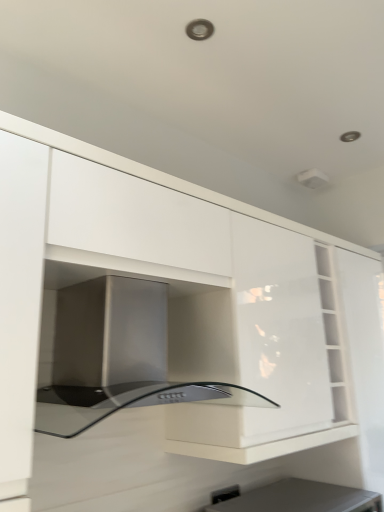
Question: From the image's perspective, relative to black plastic electric outlet at lower center, is matte black appliance at lower center above or below?

Choices:
 (A) below
 (B) above

Answer: (A)

Question: Considering the positions of point (336, 493) and point (221, 488), is point (336, 493) closer or farther from the camera than point (221, 488)?

Choices:
 (A) farther
 (B) closer

Answer: (B)

Question: Based on their relative distances, which object is farther from the stainless steel oven at center?

Choices:
 (A) black plastic electric outlet at lower center
 (B) matte black appliance at lower center

Answer: (A)

Question: Estimate the real-world distances between objects in this image. Which object is farther from the stainless steel oven at center?

Choices:
 (A) matte black appliance at lower center
 (B) black plastic electric outlet at lower center

Answer: (B)